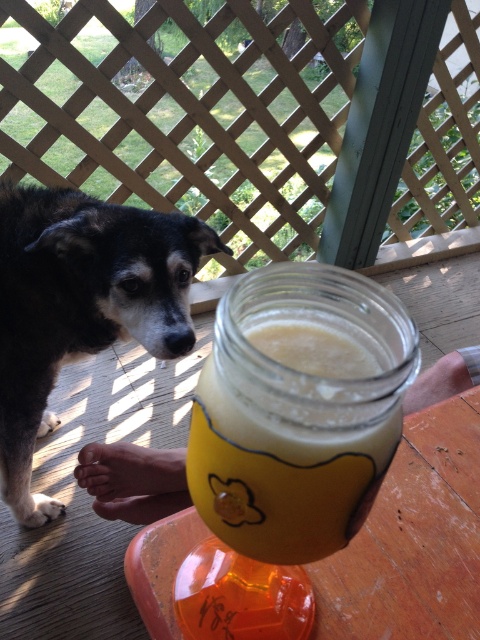
Question: Which point is closer to the camera?

Choices:
 (A) yellow matte jar at center
 (B) black fur dog at left

Answer: (A)

Question: Which of the following is the closest to the observer?

Choices:
 (A) black fur dog at left
 (B) yellow matte jar at center

Answer: (B)

Question: Does black fur dog at left appear under yellow matte jar at center?

Choices:
 (A) no
 (B) yes

Answer: (B)

Question: Does black fur dog at left lie in front of yellow matte jar at center?

Choices:
 (A) no
 (B) yes

Answer: (A)

Question: Is black fur dog at left thinner than yellow matte jar at center?

Choices:
 (A) no
 (B) yes

Answer: (A)

Question: Among these points, which one is nearest to the camera?

Choices:
 (A) (301, 493)
 (B) (36, 508)

Answer: (A)